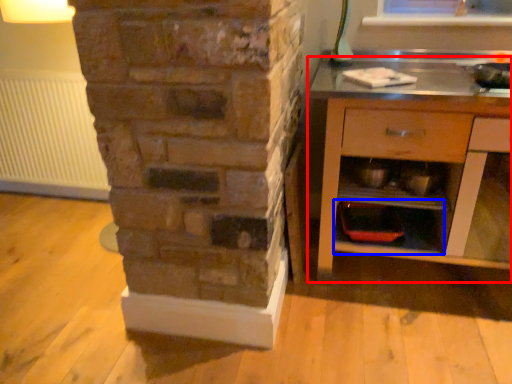
Question: Among these objects, which one is farthest to the camera, chest of drawers (highlighted by a red box) or shelf (highlighted by a blue box)?

Choices:
 (A) chest of drawers
 (B) shelf

Answer: (B)